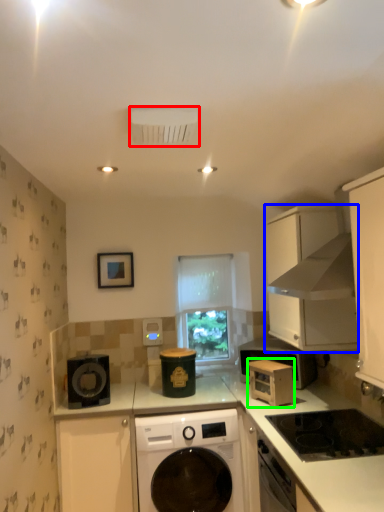
Question: Which object is positioned farthest from air conditioning (highlighted by a red box)? Select from cabinetry (highlighted by a blue box) and microwave oven (highlighted by a green box).

Choices:
 (A) cabinetry
 (B) microwave oven

Answer: (B)